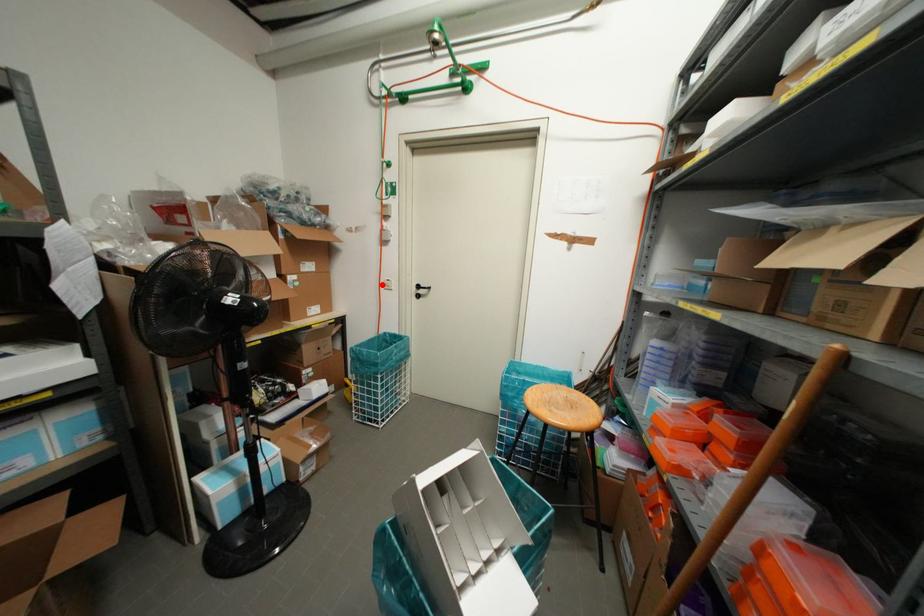
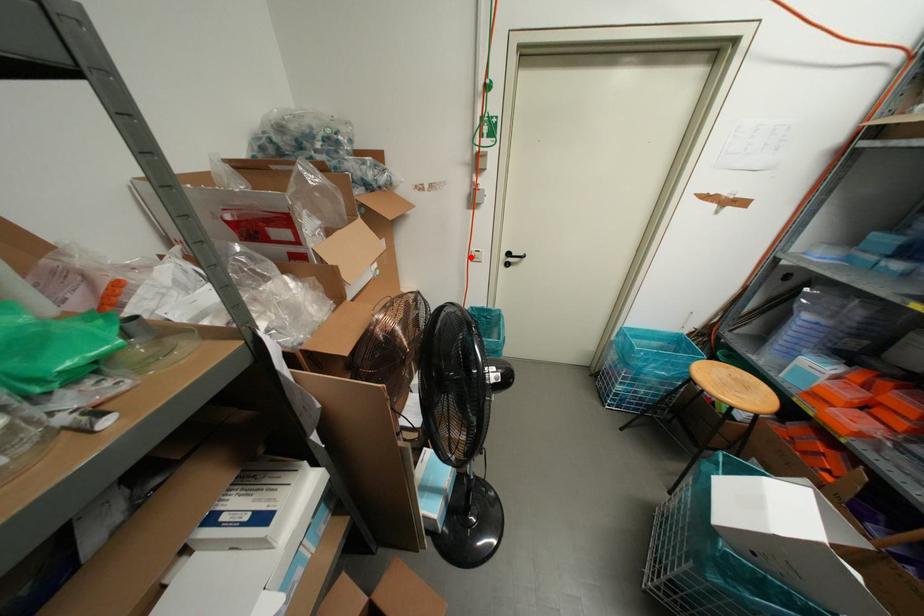
I am providing you with two images of the same scene from different viewpoints. A red point is marked on the first image and another point is marked on the second image. Do the highlighted points in image1 and image2 indicate the same real-world spot?

Yes